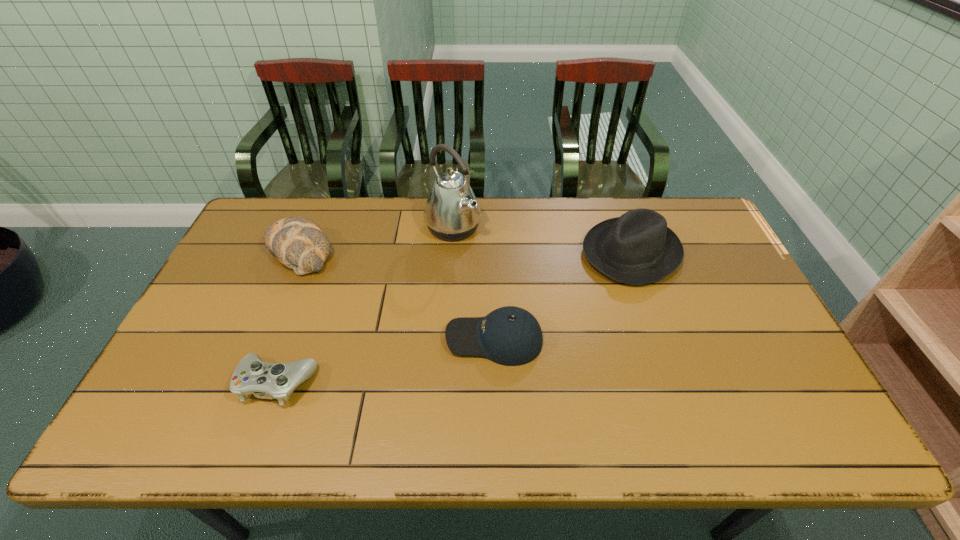
I want to click on free spot at the far edge of the desktop, so click(425, 206).

You are a GUI agent. You are given a task and a screenshot of the screen. Output one action in this format:
    pyautogui.click(x=<x>, y=<y>)
    Task: Click on the vacant space at the left edge of the desktop
    The height and width of the screenshot is (540, 960).
    Given the screenshot: What is the action you would take?
    pyautogui.click(x=195, y=387)

Where is `free space at the right edge of the desktop`? This screenshot has height=540, width=960. free space at the right edge of the desktop is located at coordinates (707, 243).

The image size is (960, 540). In order to click on blank space at the near left corner in this screenshot , I will do `click(139, 431)`.

I want to click on vacant area that lies between the baseball cap and the fedora, so click(x=563, y=295).

Identify the location of vacant area that lies between the shortest object and the baseball cap. Image resolution: width=960 pixels, height=540 pixels. (386, 361).

This screenshot has height=540, width=960. I want to click on empty space between the control and the bread, so [x=289, y=317].

Image resolution: width=960 pixels, height=540 pixels. What are the coordinates of `vacant space in between the fedora and the baseball cap` in the screenshot? It's located at (563, 295).

Locate an element on the screen. vacant area that lies between the shortest object and the bread is located at coordinates (289, 317).

Where is `empty space that is in between the bread and the baseball cap`? The height and width of the screenshot is (540, 960). empty space that is in between the bread and the baseball cap is located at coordinates (397, 295).